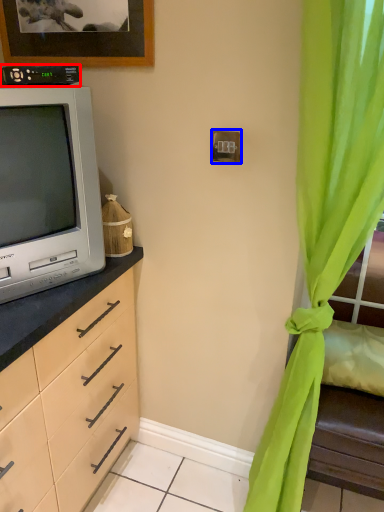
Question: Among these objects, which one is farthest to the camera, appliance (highlighted by a red box) or electric outlet (highlighted by a blue box)?

Choices:
 (A) appliance
 (B) electric outlet

Answer: (B)